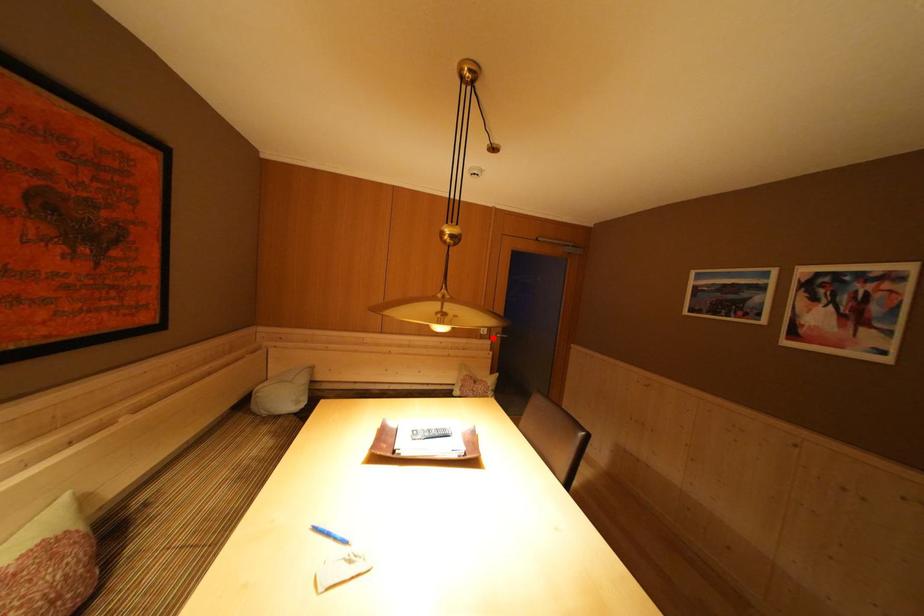
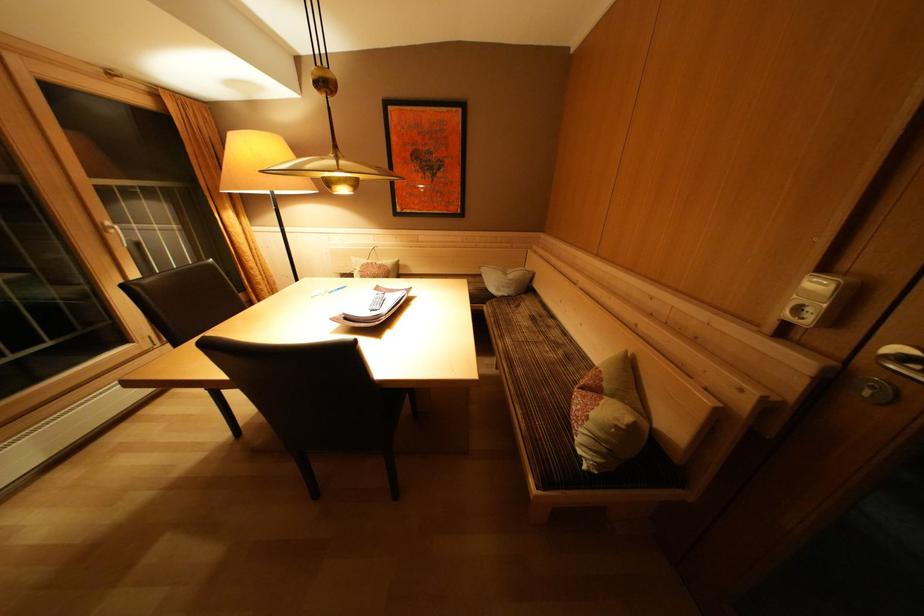
Where in the second image is the point corresponding to the highlighted location from the first image?

(815, 326)